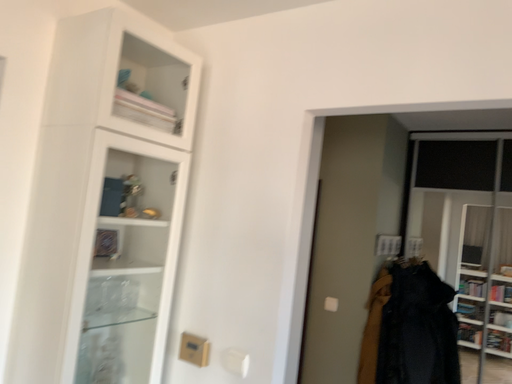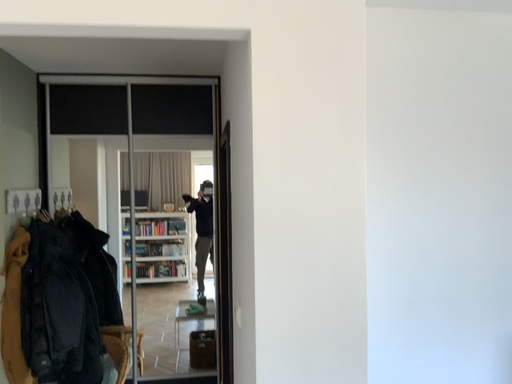
Question: How did the camera likely rotate when shooting the video?

Choices:
 (A) rotated left
 (B) rotated right

Answer: (B)